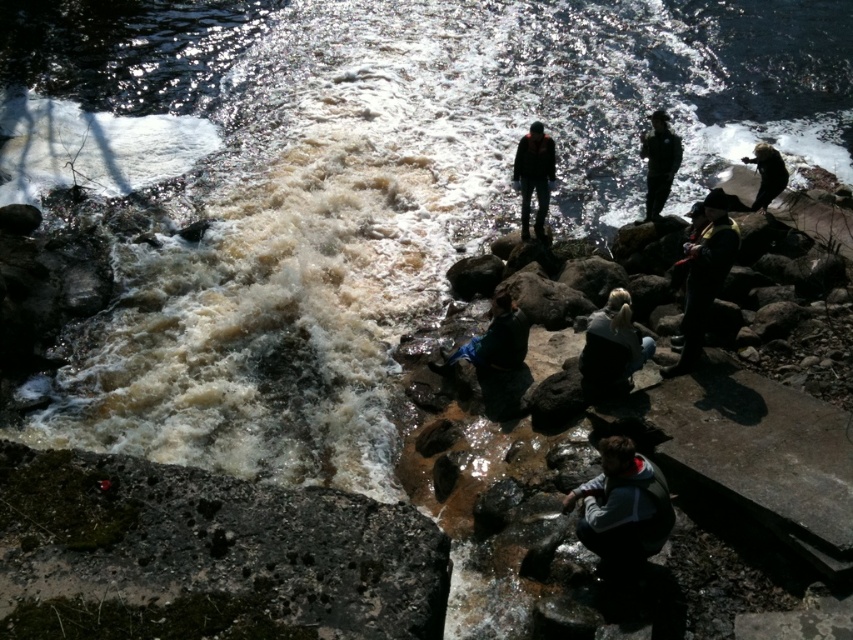
Is gray fleece jacket at lower center taller than blue denim jeans at center?

Yes, gray fleece jacket at lower center is taller than blue denim jeans at center.

Locate an element on the screen. The height and width of the screenshot is (640, 853). gray fleece jacket at lower center is located at coordinates (624, 506).

Find the location of a particular element. The width and height of the screenshot is (853, 640). gray fleece jacket at lower center is located at coordinates [624, 506].

Can you confirm if dark blue jacket at upper center is bigger than dark brown fur at upper right?

Yes.

Where is `dark blue jacket at upper center`? dark blue jacket at upper center is located at coordinates (659, 161).

Is point (177, 580) positioned after point (781, 186)?

No, (177, 580) is in front of (781, 186).

Can you confirm if green mossy rock at lower left is positioned to the left of dark brown fur at upper right?

Indeed, green mossy rock at lower left is positioned on the left side of dark brown fur at upper right.

Does point (370, 628) lie behind point (764, 156)?

No, it is in front of (764, 156).

Identify the location of green mossy rock at lower left. (206, 554).